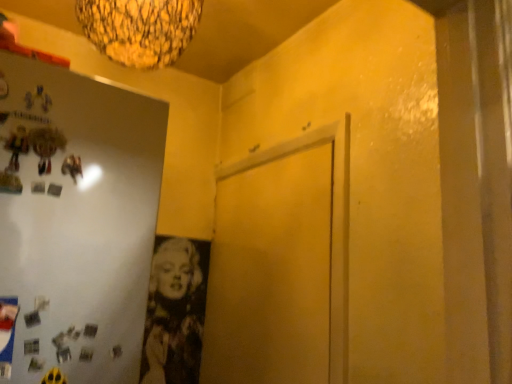
What is the approximate width of white matte refrigerator at left?

The width of white matte refrigerator at left is 0.99 inches.

The height and width of the screenshot is (384, 512). Find the location of `white matte refrigerator at left`. white matte refrigerator at left is located at coordinates (74, 223).

Describe the element at coordinates (74, 223) in the screenshot. This screenshot has width=512, height=384. I see `white matte refrigerator at left` at that location.

Where is `white matte refrigerator at left`? white matte refrigerator at left is located at coordinates (74, 223).